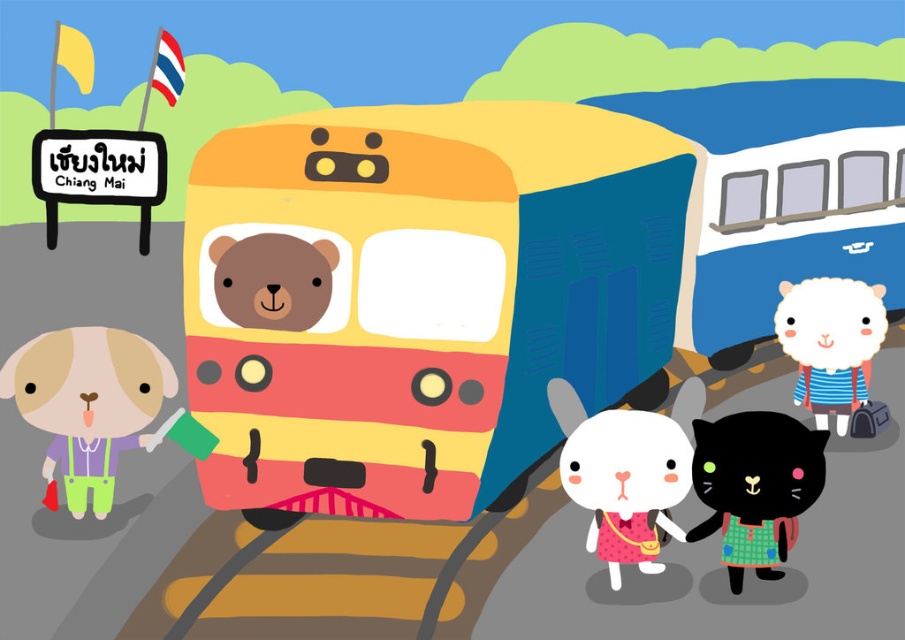
You are an animal photographer at the Chiang Mai train station. You want to take a photo of the white woolen sheep at center and the brown matte bear at center. Which animal should you focus on first if you want to capture both in the frame without adjusting your camera settings?

The white woolen sheep at center is taller than the brown matte bear at center. Since the sheep is taller, you should focus on the sheep first to ensure its full height fits in the frame before adjusting for the bear.